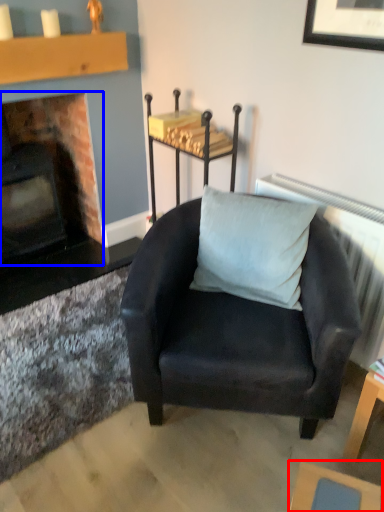
Question: Among these objects, which one is farthest to the camera, table (highlighted by a red box) or fireplace (highlighted by a blue box)?

Choices:
 (A) table
 (B) fireplace

Answer: (B)